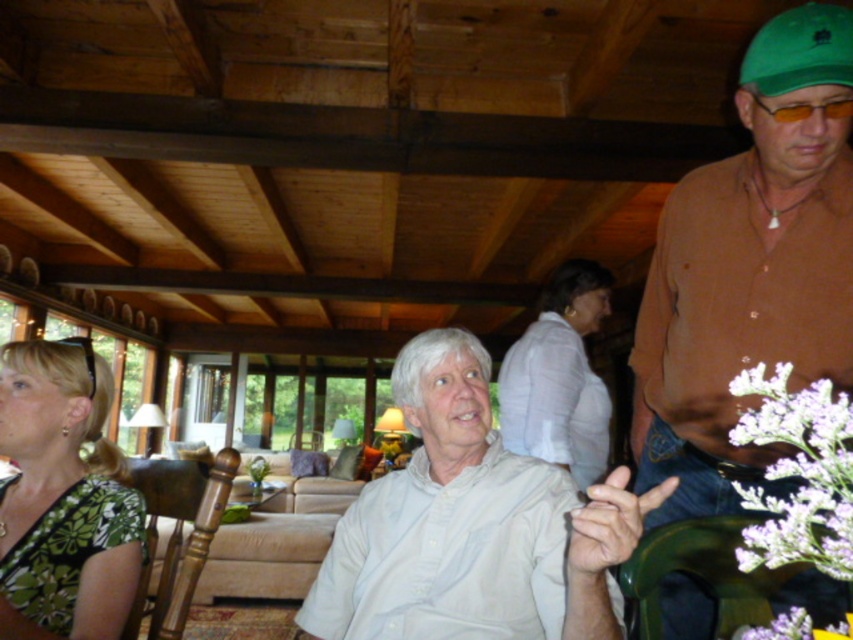
You are a photographer standing in the room and want to take a photo of the brown cotton shirt at center and the white cotton shirt at center. The camera can only focus on objects within a 10 inch range. Will both shirts be in focus?

The distance between the brown cotton shirt at center and the white cotton shirt at center is 15.31 inches, which exceeds the camera focus range of 10 inches. Therefore, both shirts cannot be in focus simultaneously.